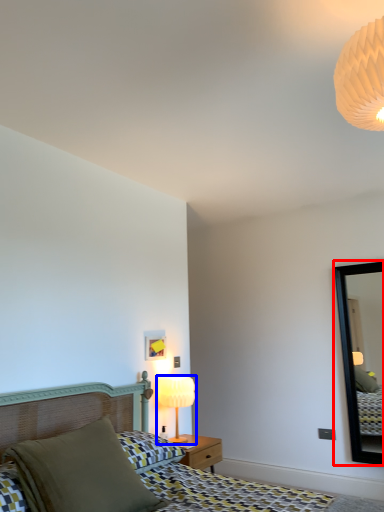
Question: Which object appears farthest to the camera in this image, mirror (highlighted by a red box) or table lamp (highlighted by a blue box)?

Choices:
 (A) mirror
 (B) table lamp

Answer: (A)